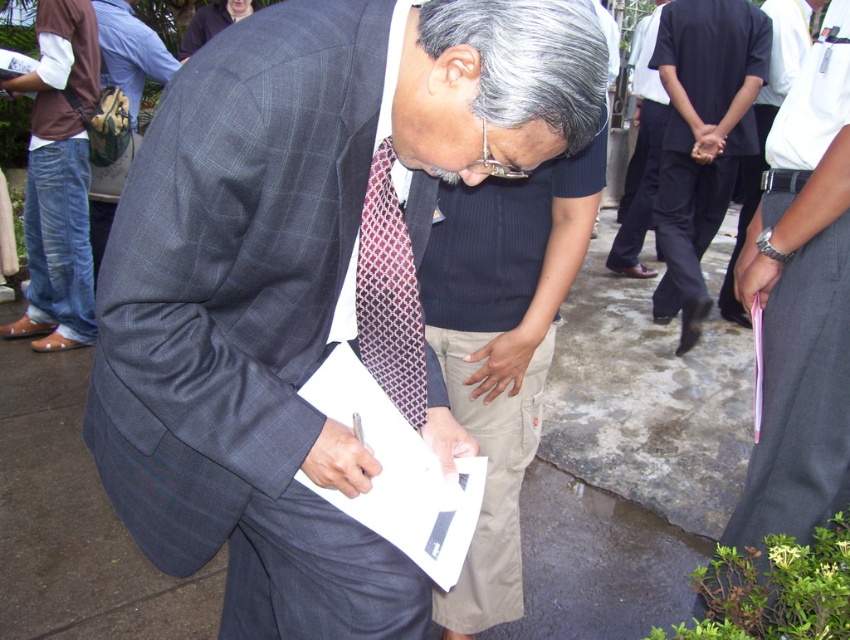
You are a photographer at the event and need to capture a clear shot of the dark gray suit at center and the plaid wool suit at center. Since the ground is wet, you want to avoid reflections. Which suit should you aim your camera at to minimize reflections?

The dark gray suit at center is below the plaid wool suit at center, so aiming at the plaid wool suit at center would be higher and less likely to reflect the wet ground.